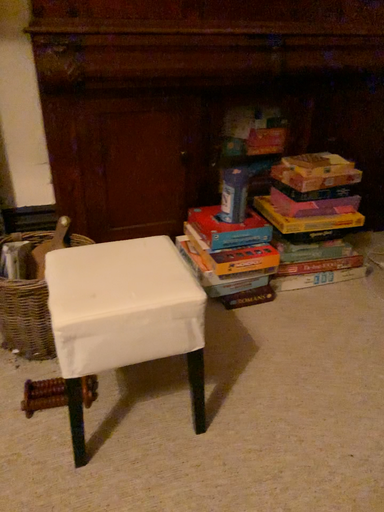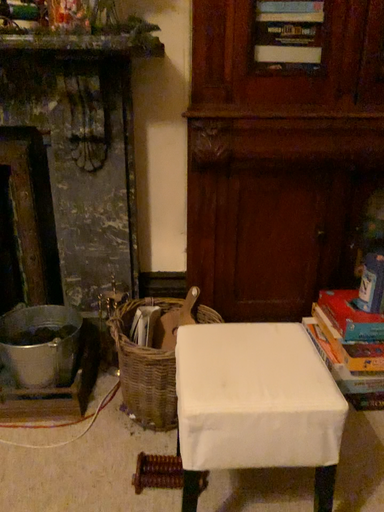
Question: Which way did the camera rotate in the video?

Choices:
 (A) rotated downward
 (B) rotated upward

Answer: (B)